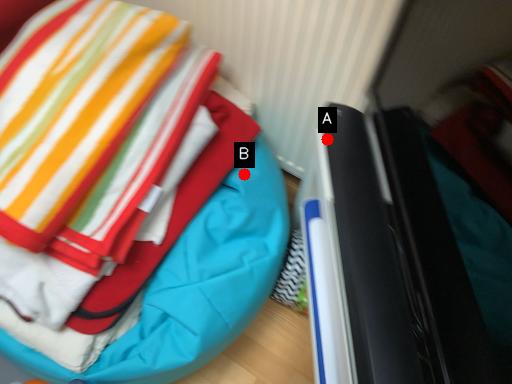
Question: Two points are circled on the image, labeled by A and B beside each circle. Among these points, which one is farthest from the camera?

Choices:
 (A) A is further
 (B) B is further

Answer: (B)